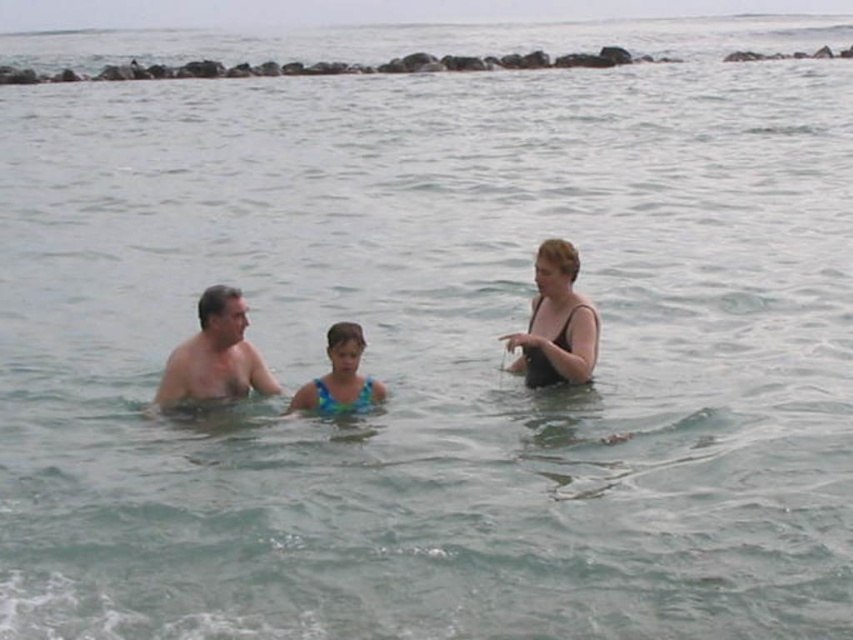
Question: In this image, where is black matte swimsuit at center located relative to blue printed swimsuit at center?

Choices:
 (A) below
 (B) above

Answer: (B)

Question: Which of these objects is positioned closest to the black matte swimsuit at center?

Choices:
 (A) skinny white man at left
 (B) blue textured swimsuit at center

Answer: (B)

Question: Does black matte swimsuit at center have a lesser width compared to skinny white man at left?

Choices:
 (A) yes
 (B) no

Answer: (A)

Question: Is blue printed swimsuit at center behind blue textured swimsuit at center?

Choices:
 (A) no
 (B) yes

Answer: (A)

Question: Which point is closer to the camera?

Choices:
 (A) blue printed swimsuit at center
 (B) black matte swimsuit at center
 (C) skinny white man at left

Answer: (C)

Question: Which point appears farthest from the camera in this image?

Choices:
 (A) (546, 314)
 (B) (173, 348)

Answer: (A)